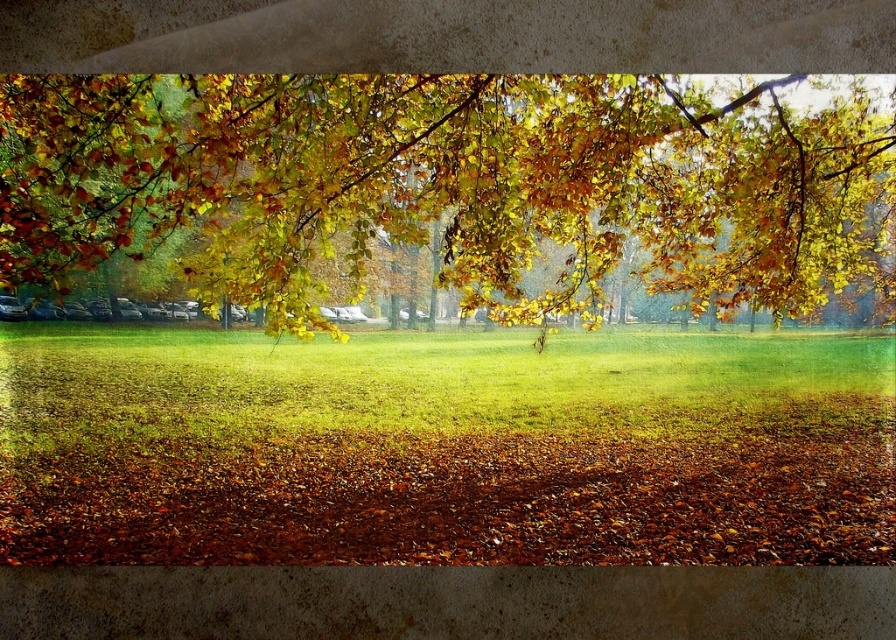
Who is more distant from viewer, (626,163) or (13,339)?

Positioned behind is point (13,339).

Can you confirm if yellow-green leaves at upper center is taller than green grassy field at center?

Yes, yellow-green leaves at upper center is taller than green grassy field at center.

Who is more distant from viewer, (410, 138) or (237, 444)?

Positioned behind is point (237, 444).

You are a GUI agent. You are given a task and a screenshot of the screen. Output one action in this format:
    pyautogui.click(x=<x>, y=<y>)
    Task: Click on the yellow-green leaves at upper center
    This screenshot has width=896, height=640.
    Given the screenshot: What is the action you would take?
    pyautogui.click(x=448, y=184)